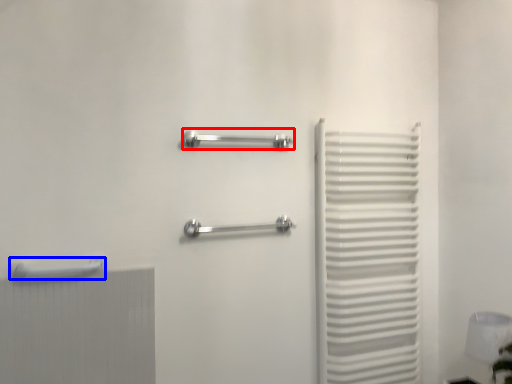
Question: Which of the following is the closest to the observer, towel rack (highlighted by a red box) or towel rack (highlighted by a blue box)?

Choices:
 (A) towel rack
 (B) towel rack

Answer: (B)